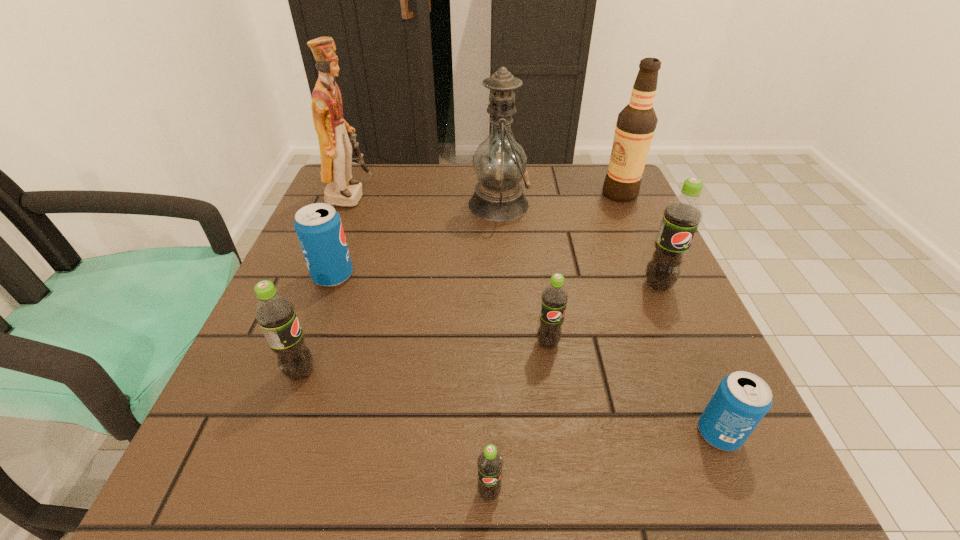
Find the location of a particular element. The height and width of the screenshot is (540, 960). the bigger blue soda can is located at coordinates pos(318,226).

You are a GUI agent. You are given a task and a screenshot of the screen. Output one action in this format:
    pyautogui.click(x=<x>, y=<y>)
    Task: Click on the nearer blue soda can
    The width and height of the screenshot is (960, 540).
    Given the screenshot: What is the action you would take?
    pyautogui.click(x=742, y=399)

Find the location of a particular element. The image size is (960, 540). the fifth farthest soda is located at coordinates (742, 399).

Where is `the nearest soda`? the nearest soda is located at coordinates (489, 462).

You are a GUI agent. You are given a task and a screenshot of the screen. Output one action in this format:
    pyautogui.click(x=<x>, y=<y>)
    Task: Click on the smallest green soda
    The image size is (960, 540).
    Given the screenshot: What is the action you would take?
    pyautogui.click(x=489, y=462)

Identify the location of free space located 0.140m on the front-facing side of the red nutcracker. (424, 195).

Locate an element on the screen. blank space located on the front of the gray oil lamp is located at coordinates (504, 293).

Image resolution: width=960 pixels, height=540 pixels. Find the location of `vacant space located on the label of the beige alcohol`. vacant space located on the label of the beige alcohol is located at coordinates (547, 194).

Locate an element on the screen. This screenshot has height=540, width=960. free location located on the label of the beige alcohol is located at coordinates (579, 194).

Identify the location of free region located 0.060m on the label of the beige alcohol. The height and width of the screenshot is (540, 960). (579, 194).